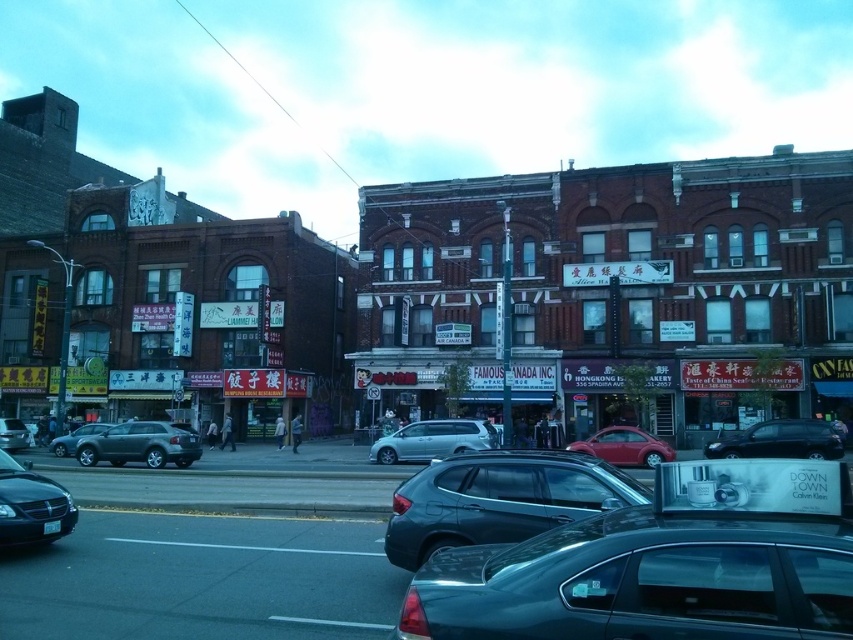
Question: Does matte black sedan at lower left appear on the left side of shiny black suv at center?

Choices:
 (A) yes
 (B) no

Answer: (A)

Question: Which object is the farthest from the satin silver car at center?

Choices:
 (A) satin black suv at center
 (B) matte black sedan at lower left
 (C) brown brick building at center
 (D) matte black car at center

Answer: (D)

Question: Which of the following is the farthest from the observer?

Choices:
 (A) matte black sedan at lower left
 (B) satin silver car at center
 (C) satin silver sedan at center

Answer: (C)

Question: Can you confirm if shiny black suv at center is wider than satin silver sedan at center?

Choices:
 (A) yes
 (B) no

Answer: (B)

Question: Which point appears closest to the camera in this image?

Choices:
 (A) (105, 428)
 (B) (413, 435)
 (C) (137, 451)

Answer: (C)

Question: Can you confirm if satin silver car at center is bigger than matte red car at center?

Choices:
 (A) yes
 (B) no

Answer: (A)